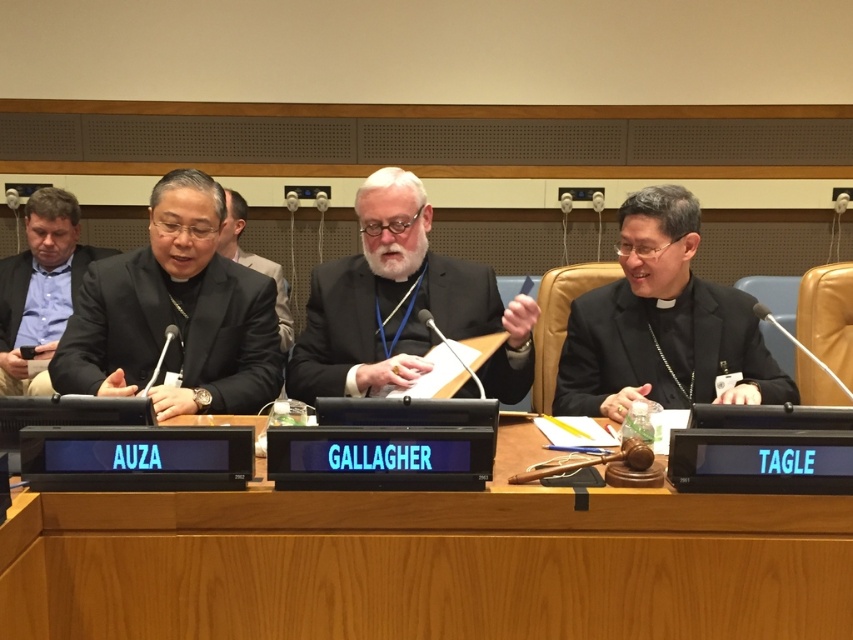
Which is behind, point (222, 298) or point (621, 280)?

Positioned behind is point (222, 298).

Locate an element on the screen. Image resolution: width=853 pixels, height=640 pixels. black satin robe at left is located at coordinates (180, 332).

Does wooden table at center appear on the right side of black matte robe at right?

Incorrect, wooden table at center is not on the right side of black matte robe at right.

Which is more to the left, wooden table at center or black matte robe at right?

wooden table at center is more to the left.

The width and height of the screenshot is (853, 640). What are the coordinates of `wooden table at center` in the screenshot? It's located at (427, 561).

Locate an element on the screen. wooden table at center is located at coordinates (427, 561).

Does point (541, 593) lie in front of point (129, 356)?

Yes, it is in front of point (129, 356).

Identify the location of wooden table at center. The width and height of the screenshot is (853, 640). (427, 561).